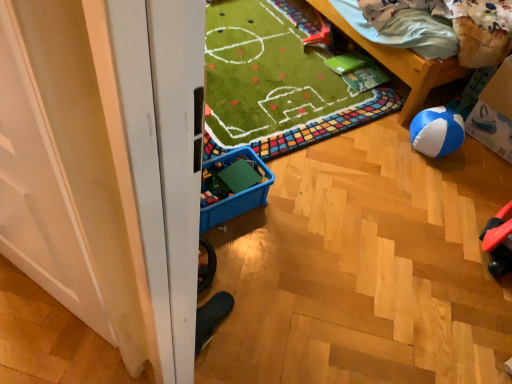
Find the location of a particular element. The image size is (512, 384). rubberized plastic toy at upper center is located at coordinates pos(319,37).

At what (x,y) coordinates should I click in order to perform the action: click on blue plastic storage box at center. Please return your answer as a coordinate pair (x, y). This screenshot has height=384, width=512. Looking at the image, I should click on (234, 194).

Between blue plastic storage box at center and wooden bed at upper right, which one has smaller size?

With smaller size is blue plastic storage box at center.

Consider the image. Is wooden bed at upper right a part of blue plastic storage box at center?

No, wooden bed at upper right is located outside of blue plastic storage box at center.

Considering the sizes of objects blue plastic storage box at center and wooden bed at upper right in the image provided, who is thinner, blue plastic storage box at center or wooden bed at upper right?

blue plastic storage box at center.

Is rubberized plastic toy at upper center bigger or smaller than wooden bed at upper right?

Clearly, rubberized plastic toy at upper center is smaller in size than wooden bed at upper right.

Could you tell me if rubberized plastic toy at upper center is facing wooden bed at upper right?

No.

Between rubberized plastic toy at upper center and wooden bed at upper right, which one appears on the left side from the viewer's perspective?

rubberized plastic toy at upper center.

Does point (250, 197) lie behind point (308, 44)?

No.

Considering the relative positions of blue plastic storage box at center and rubberized plastic toy at upper center in the image provided, is blue plastic storage box at center in front of rubberized plastic toy at upper center?

Yes.

Is blue plastic storage box at center situated inside rubberized plastic toy at upper center or outside?

blue plastic storage box at center is located beyond the bounds of rubberized plastic toy at upper center.

Is blue plastic storage box at center to the left or to the right of rubberized plastic toy at upper center in the image?

In the image, blue plastic storage box at center appears on the left side of rubberized plastic toy at upper center.

From a real-world perspective, is rubberized plastic toy at upper center physically below blue plastic storage box at center?

Yes.

Is rubberized plastic toy at upper center closer to the viewer compared to blue plastic storage box at center?

That is False.

The width and height of the screenshot is (512, 384). I want to click on storage box that appears in front of the cardboard box at right, so tap(234, 194).

From a real-world perspective, does cardboard box at right sit lower than blue plastic storage box at center?

No, from a real-world perspective, cardboard box at right is not under blue plastic storage box at center.

Is blue plastic storage box at center completely or partially inside cardboard box at right?

Actually, blue plastic storage box at center is outside cardboard box at right.

Is cardboard box at right positioned with its back to blue plastic storage box at center?

No, blue plastic storage box at center is not at the back of cardboard box at right.

Looking at this image, from a real-world perspective, is wooden bed at upper right positioned under blue plastic storage box at center based on gravity?

No, from a real-world perspective, wooden bed at upper right is not beneath blue plastic storage box at center.

Can you see wooden bed at upper right touching blue plastic storage box at center?

No, wooden bed at upper right is not touching blue plastic storage box at center.

Considering the relative positions of wooden bed at upper right and blue plastic storage box at center in the image provided, is wooden bed at upper right to the right of blue plastic storage box at center from the viewer's perspective?

Yes.

Is wooden bed at upper right positioned beyond the bounds of blue plastic storage box at center?

Indeed, wooden bed at upper right is completely outside blue plastic storage box at center.

Could you tell me if wooden bed at upper right is turned towards cardboard box at right?

No, wooden bed at upper right is not facing towards cardboard box at right.

Considering the sizes of objects wooden bed at upper right and cardboard box at right in the image provided, who is shorter, wooden bed at upper right or cardboard box at right?

wooden bed at upper right is shorter.

Does point (466, 70) come in front of point (497, 111)?

No, (466, 70) is further to viewer.

How many degrees apart are the facing directions of wooden bed at upper right and cardboard box at right?

There is a 10.1-degree angle between the facing directions of wooden bed at upper right and cardboard box at right.

Identify the location of furniture behind the blue plastic storage box at center. Image resolution: width=512 pixels, height=384 pixels. (400, 64).

This screenshot has width=512, height=384. What are the coordinates of `toy below the wooden bed at upper right (from the image's perspective)` in the screenshot? It's located at (319, 37).

Estimate the real-world distances between objects in this image. Which object is closer to rubberized plastic toy at upper center, cardboard box at right or wooden bed at upper right?

wooden bed at upper right is positioned closer to the anchor rubberized plastic toy at upper center.

Looking at the image, which one is located further to wooden bed at upper right, rubberized plastic toy at upper center or cardboard box at right?

rubberized plastic toy at upper center lies further to wooden bed at upper right than the other object.

From the image, which object appears to be nearer to blue plastic storage box at center, wooden bed at upper right or cardboard box at right?

wooden bed at upper right lies closer to blue plastic storage box at center than the other object.

Looking at the image, which one is located further to cardboard box at right, wooden bed at upper right or blue plastic storage box at center?

The object further to cardboard box at right is blue plastic storage box at center.

Based on their spatial positions, is blue plastic storage box at center or rubberized plastic toy at upper center closer to wooden bed at upper right?

rubberized plastic toy at upper center is closer to wooden bed at upper right.

From the image, which object appears to be nearer to cardboard box at right, wooden bed at upper right or rubberized plastic toy at upper center?

wooden bed at upper right lies closer to cardboard box at right than the other object.

Based on their spatial positions, is blue plastic storage box at center or rubberized plastic toy at upper center further from cardboard box at right?

Among the two, blue plastic storage box at center is located further to cardboard box at right.

When comparing their distances from blue plastic storage box at center, does wooden bed at upper right or rubberized plastic toy at upper center seem further?

Based on the image, rubberized plastic toy at upper center appears to be further to blue plastic storage box at center.

At what (x,y) coordinates should I click in order to perform the action: click on toy between wooden bed at upper right and blue plastic storage box at center vertically. Please return your answer as a coordinate pair (x, y). Looking at the image, I should click on (319, 37).

Locate an element on the screen. The height and width of the screenshot is (384, 512). toy between blue plastic storage box at center and cardboard box at right in the horizontal direction is located at coordinates [319, 37].

At what (x,y) coordinates should I click in order to perform the action: click on furniture between rubberized plastic toy at upper center and cardboard box at right. Please return your answer as a coordinate pair (x, y). This screenshot has width=512, height=384. Looking at the image, I should click on (400, 64).

At what (x,y) coordinates should I click in order to perform the action: click on furniture between blue plastic storage box at center and cardboard box at right from left to right. Please return your answer as a coordinate pair (x, y). The image size is (512, 384). Looking at the image, I should click on (400, 64).